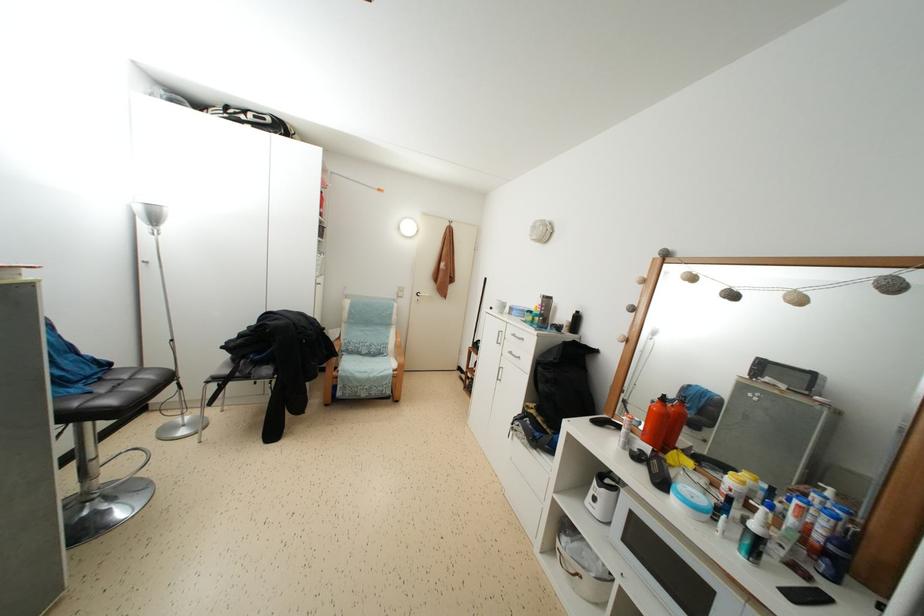
This screenshot has height=616, width=924. Identify the location of red water bottle. pos(675,422).